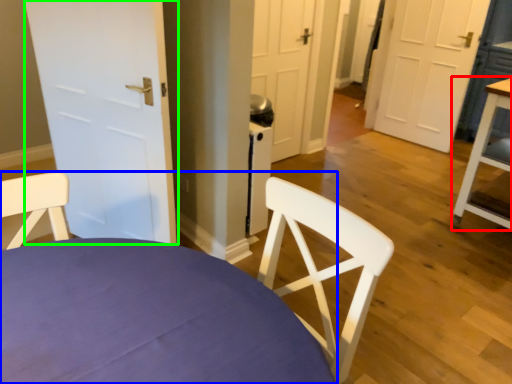
Question: Based on their relative distances, which object is farther from table (highlighted by a red box)? Choose from chair (highlighted by a blue box) and door (highlighted by a green box).

Choices:
 (A) chair
 (B) door

Answer: (A)